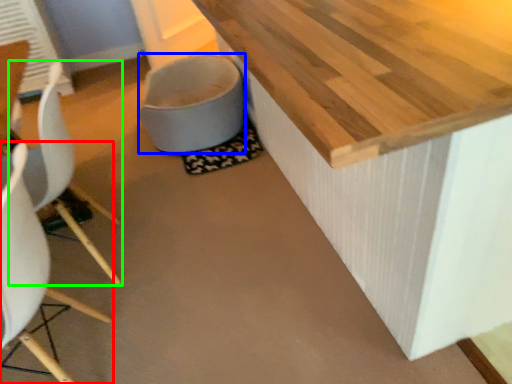
Question: Based on their relative distances, which object is nearer to chair (highlighted by a red box)? Choose from toilet bowl (highlighted by a blue box) and chair (highlighted by a green box).

Choices:
 (A) toilet bowl
 (B) chair

Answer: (B)